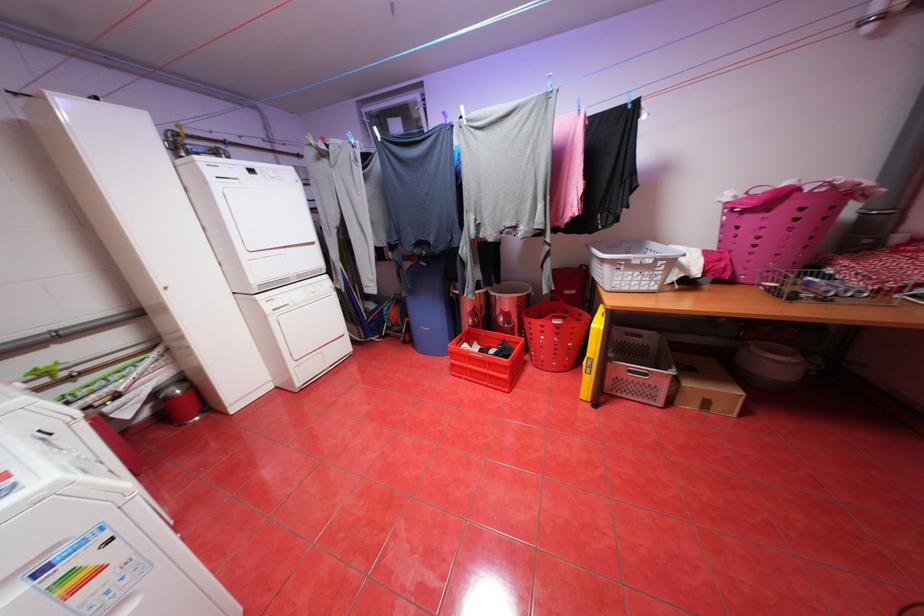
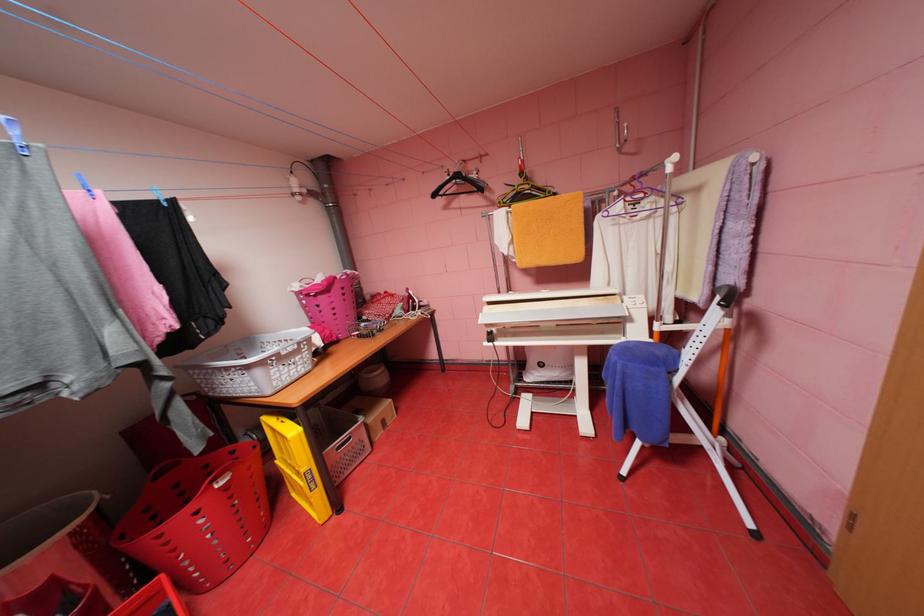
Question: The camera is either moving clockwise (left) or counter-clockwise (right) around the object. The first image is from the beginning of the video and the second image is from the end. Is the camera moving left or right when shooting the video?

Choices:
 (A) Left
 (B) Right

Answer: (A)